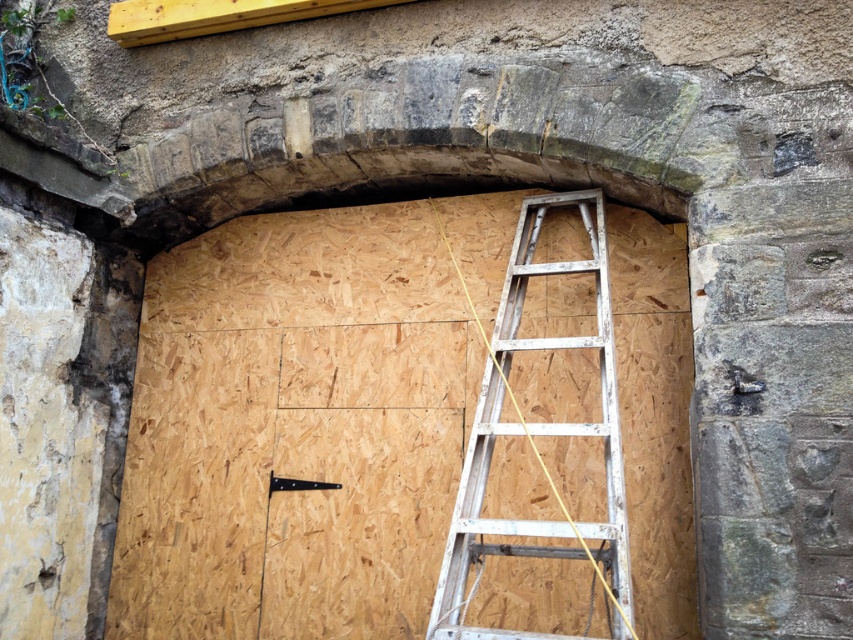
Question: Which point appears closest to the camera in this image?

Choices:
 (A) (270, 472)
 (B) (577, 550)

Answer: (B)

Question: Can you confirm if white aluminum ladder at center is positioned to the right of black metal hinge at center?

Choices:
 (A) yes
 (B) no

Answer: (A)

Question: Can you confirm if white aluminum ladder at center is positioned to the right of black metal hinge at center?

Choices:
 (A) no
 (B) yes

Answer: (B)

Question: Can you confirm if white aluminum ladder at center is positioned above black metal hinge at center?

Choices:
 (A) no
 (B) yes

Answer: (B)

Question: Which of the following is the closest to the observer?

Choices:
 (A) white aluminum ladder at center
 (B) black metal hinge at center

Answer: (A)